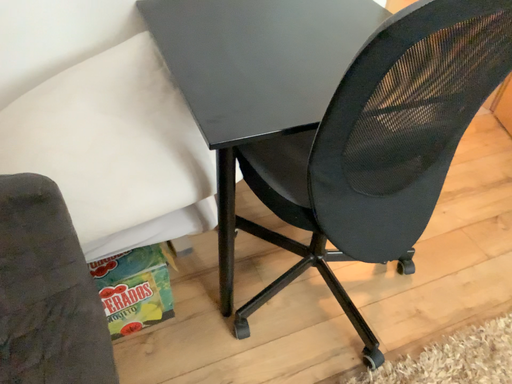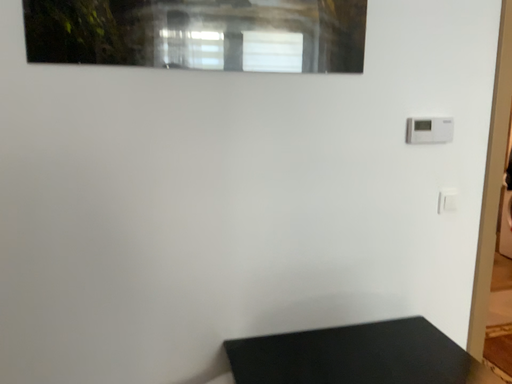
Question: How did the camera likely rotate when shooting the video?

Choices:
 (A) rotated upward
 (B) rotated downward

Answer: (A)